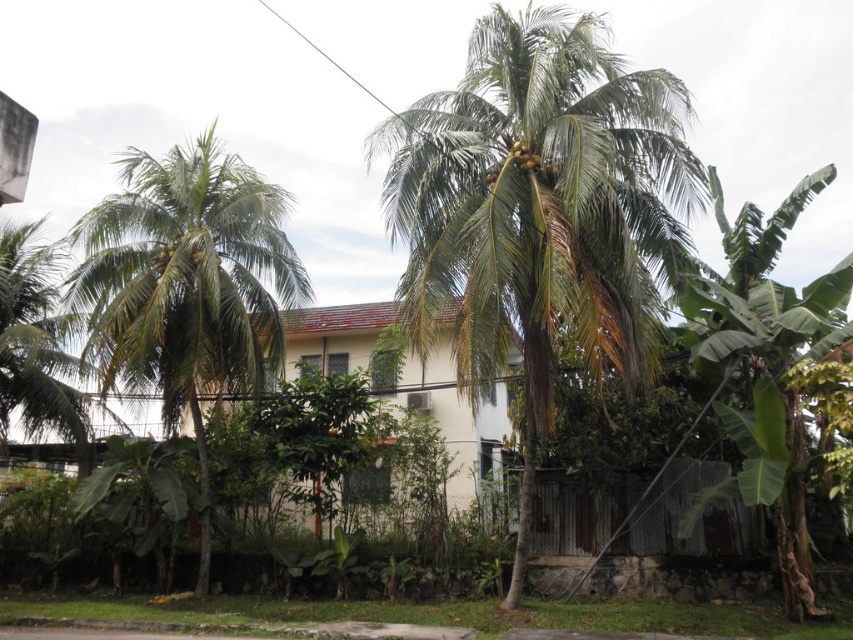
You are standing at the bottom of the green leafy coconut tree at center and want to walk to the green leafy coconut tree at right. Which direction should you face to walk towards it?

The green leafy coconut tree at center is located above the green leafy coconut tree at right, so you should face downward to walk towards the green leafy coconut tree at right.

In the scene shown: You are planning to plant a new coconut tree in this residential area. Given the existing green leafy coconut tree at left and the green leafy coconut tree at right, which one would require more space to accommodate its size?

The green leafy coconut tree at left is larger in size than the green leafy coconut tree at right, so it would require more space to accommodate its size.